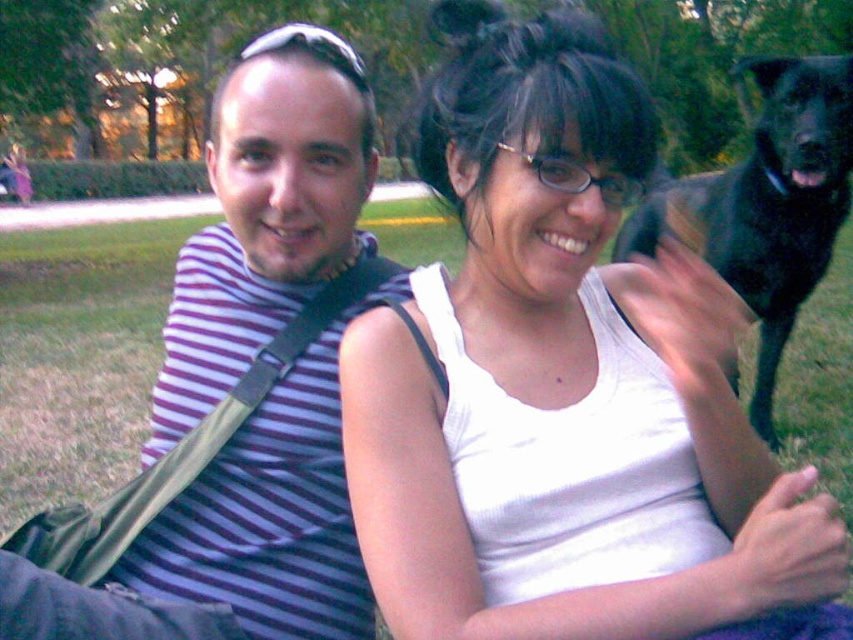
You are taking a photo of the scene and want to focus on the white tank top at center and the purple striped shirt at left. Which one should you adjust your camera to focus on first if you want to capture both clearly?

You should focus on the white tank top at center first because it is closer to the viewer than the purple striped shirt at left, allowing for better depth of field when capturing both.

You are standing at the origin of a coordinate system placed at the bottom left corner of the image. The coordinates given are normalized between 0 and 1. A point at (x=265, y=216) marks the location of the purple striped shirt at left. If you want to walk directly to the purple striped shirt at left from your current position, which direction should you move?

Since the coordinate system has its origin at the bottom left corner, moving towards the purple striped shirt at left would require moving to the right along the x axis and upwards along the y axis because the point is at 0.338 in x and 0.312 in y.

You are a photographer trying to capture a clear shot of the white tank top at center and the black furry dog at upper right. Which object is closer to the camera?

The white tank top at center is closer to the camera because it is in front of the black furry dog at upper right.